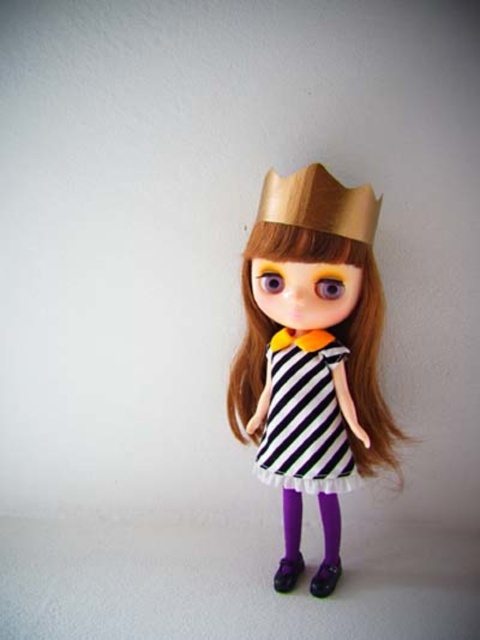
You are a photographer setting up a shoot with the doll. You want to ensure that both the wooden crown at center and the black and white striped dress at center are clearly visible in the photo. Based on their positions, which object might appear partially obscured and why?

The wooden crown at center might appear partially obscured because it is positioned behind the black and white striped dress at center, so part of it could be hidden from view.

You are an observer looking at the doll. Which dress is closer to you, the black and white striped dress at center or the black striped dress at center?

The black and white striped dress at center is closer to you because it is in front of the black striped dress at center.

You are a fashion designer trying to create a matching accessory for the doll. You have two options for a belt placement. The first option is to place it 2 inches below the black and white striped dress at center. The second option is to place it 2 inches below the black striped dress at center. Which placement would be closer to the bottom of the dress?

The black and white striped dress at center is 2.02 inches from the black striped dress at center. Since the first option is 2 inches below the black and white striped dress and the second option is 2 inches below the black striped dress, the first option placement would be slightly closer to the bottom of the dress because the distance between the two dresses is 2.02 inches, making the second option placement 0.02 inches further away.